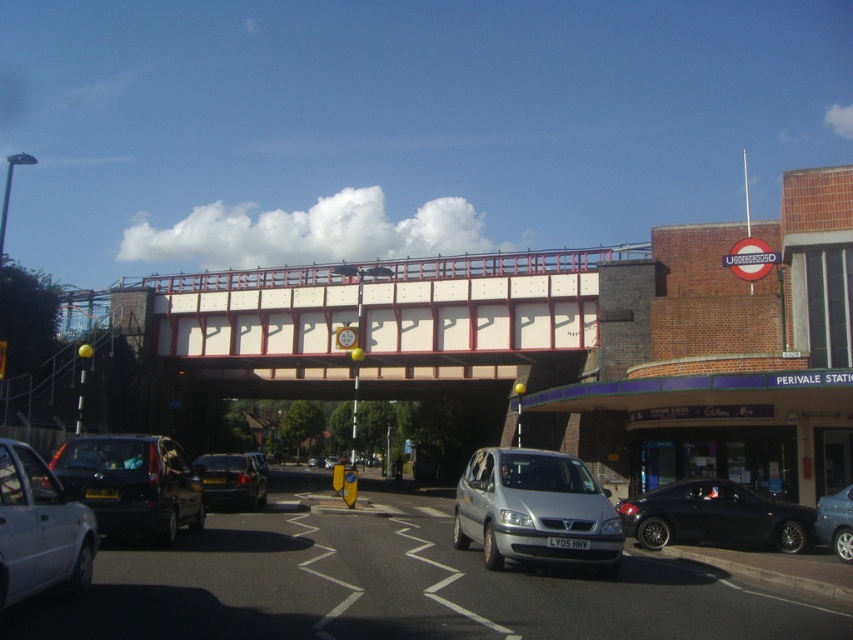
Which is in front, point (465, 515) or point (70, 465)?

Positioned in front is point (70, 465).

In the scene shown: Can you confirm if silver metallic van at center is bigger than matte black van at lower left?

Correct, silver metallic van at center is larger in size than matte black van at lower left.

I want to click on silver metallic van at center, so click(x=535, y=509).

At what (x,y) coordinates should I click in order to perform the action: click on silver metallic van at center. Please return your answer as a coordinate pair (x, y). This screenshot has height=640, width=853. Looking at the image, I should click on (535, 509).

Can you confirm if matte black van at lower left is smaller than blue metallic sedan at lower right?

No, matte black van at lower left is not smaller than blue metallic sedan at lower right.

Is point (146, 481) closer to viewer compared to point (824, 506)?

Yes, it is.

Identify the location of matte black van at lower left. The image size is (853, 640). (134, 483).

Is white painted concrete bridge at center to the right of blue metallic sedan at lower right from the viewer's perspective?

No, white painted concrete bridge at center is not to the right of blue metallic sedan at lower right.

Consider the image. Can you confirm if white painted concrete bridge at center is positioned below blue metallic sedan at lower right?

No.

At what (x,y) coordinates should I click in order to perform the action: click on white painted concrete bridge at center. Please return your answer as a coordinate pair (x, y). Looking at the image, I should click on (381, 316).